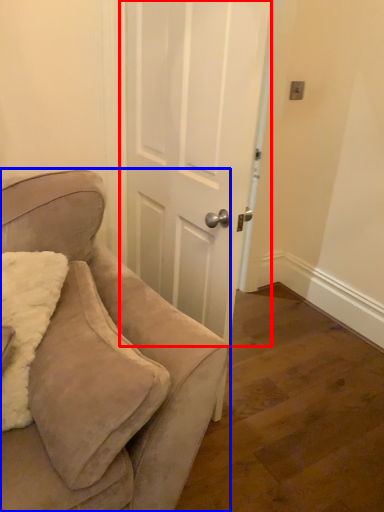
Question: Among these objects, which one is farthest to the camera, door (highlighted by a red box) or chair (highlighted by a blue box)?

Choices:
 (A) door
 (B) chair

Answer: (A)